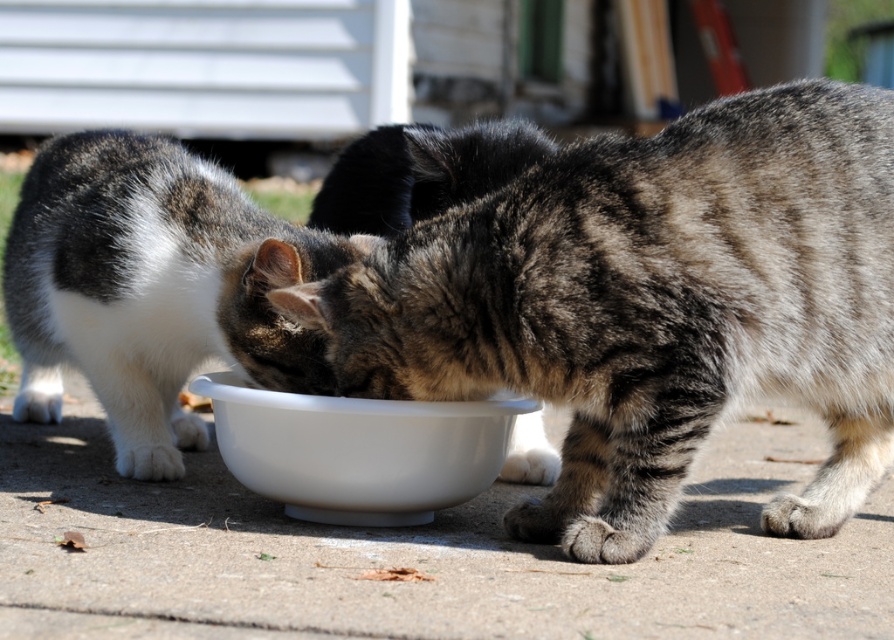
Question: Is tabby fur cat at center to the right of tabby fur cat at left from the viewer's perspective?

Choices:
 (A) yes
 (B) no

Answer: (A)

Question: Which point is closer to the camera?

Choices:
 (A) tabby fur cat at center
 (B) white glossy bowl at center

Answer: (A)

Question: Which object appears closest to the camera in this image?

Choices:
 (A) white glossy bowl at center
 (B) tabby fur cat at left

Answer: (A)

Question: Is tabby fur cat at center further to camera compared to white glossy bowl at center?

Choices:
 (A) yes
 (B) no

Answer: (B)

Question: Can you confirm if tabby fur cat at center is thinner than white glossy bowl at center?

Choices:
 (A) yes
 (B) no

Answer: (B)

Question: Which object appears closest to the camera in this image?

Choices:
 (A) tabby fur cat at left
 (B) tabby fur cat at center
 (C) white glossy bowl at center

Answer: (B)